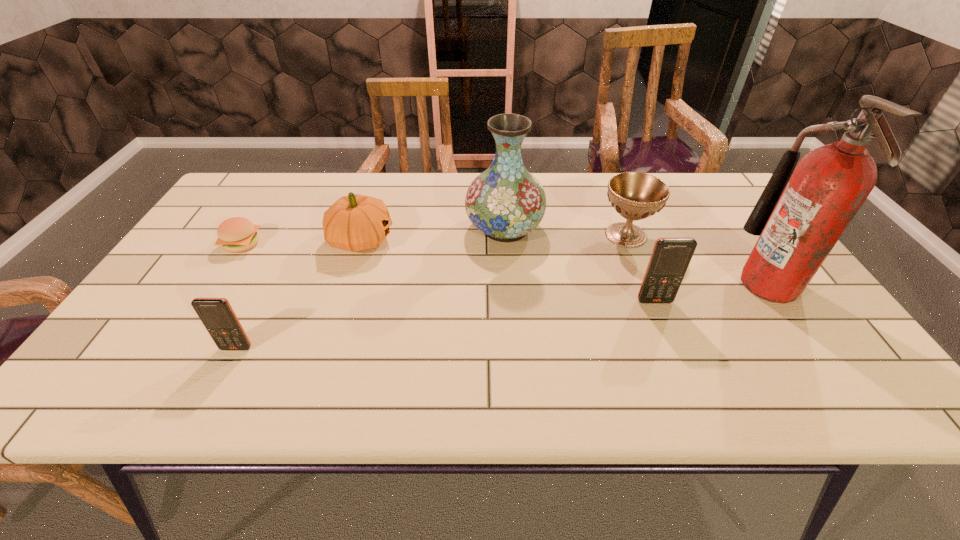
In order to click on object at the far edge in this screenshot , I will do `click(505, 202)`.

Where is `object that is at the near edge`? Image resolution: width=960 pixels, height=540 pixels. object that is at the near edge is located at coordinates tap(218, 317).

The width and height of the screenshot is (960, 540). I want to click on object positioned at the left edge, so click(x=237, y=234).

Identify the location of object that is at the right edge. The width and height of the screenshot is (960, 540). (799, 217).

You are a GUI agent. You are given a task and a screenshot of the screen. Output one action in this format:
    pyautogui.click(x=<x>, y=<y>)
    Task: Click on the free space at the far edge of the desktop
    
    Given the screenshot: What is the action you would take?
    pyautogui.click(x=571, y=213)

Locate an element on the screen. vacant region at the near edge of the desktop is located at coordinates (575, 350).

Find the location of a particular element. free space at the right edge of the desktop is located at coordinates (724, 235).

This screenshot has height=540, width=960. In order to click on vacant space at the far left corner of the desktop in this screenshot , I will do `click(280, 191)`.

This screenshot has width=960, height=540. Identify the location of free location at the far right corner of the desktop. (685, 202).

Locate an element on the screen. The image size is (960, 540). vacant area that lies between the right cellular telephone and the chalice is located at coordinates (640, 268).